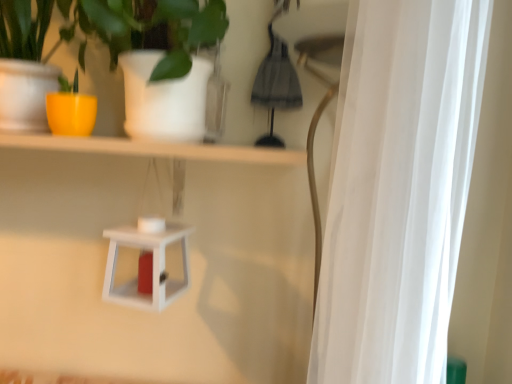
Question: Looking at the image, does white sheer curtain at right seem bigger or smaller compared to white matte lantern at center?

Choices:
 (A) small
 (B) big

Answer: (B)

Question: From the image's perspective, relative to white matte lantern at center, is white sheer curtain at right above or below?

Choices:
 (A) above
 (B) below

Answer: (A)

Question: Based on their relative distances, which object is nearer to the white matte lantern at center?

Choices:
 (A) white sheer curtain at right
 (B) yellow matte pot at left

Answer: (B)

Question: Estimate the real-world distances between objects in this image. Which object is closer to the yellow matte pot at left?

Choices:
 (A) white matte lantern at center
 (B) white sheer curtain at right

Answer: (A)